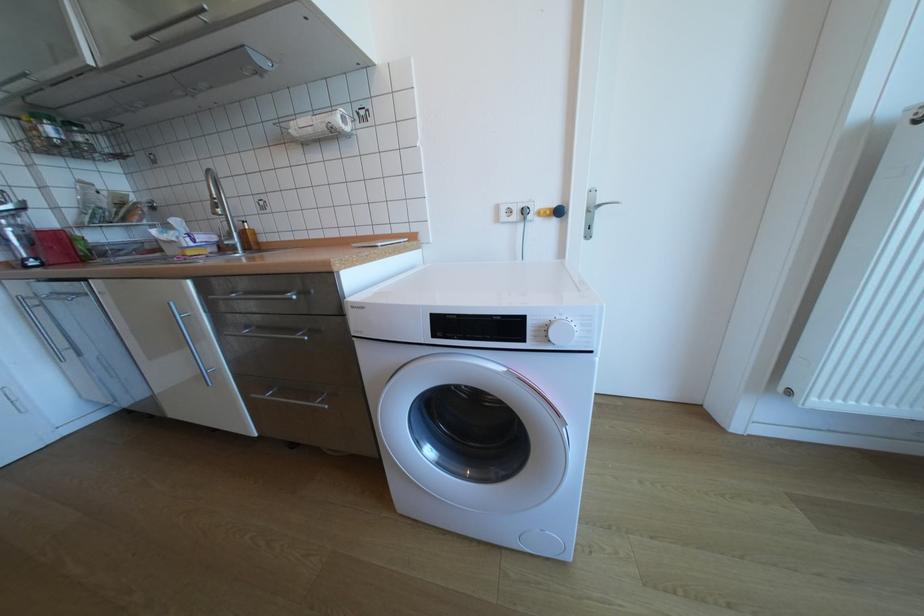
Where would you rotat the metal faucet handle? Please return your answer as a coordinate pair (x, y).

(225, 240)